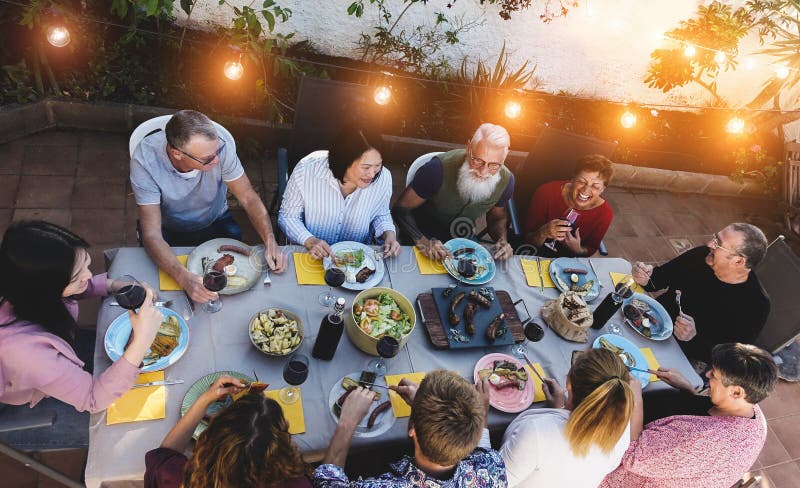
Find the location of a particular element. glasses of wine is located at coordinates (132, 298), (216, 276), (341, 273), (572, 215), (632, 287), (473, 270), (530, 329), (392, 344), (293, 372).